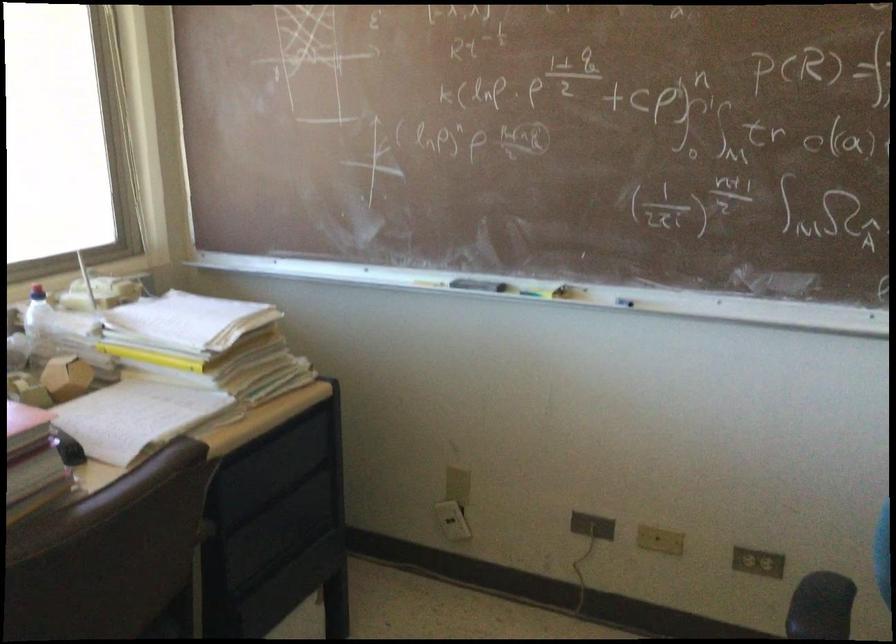
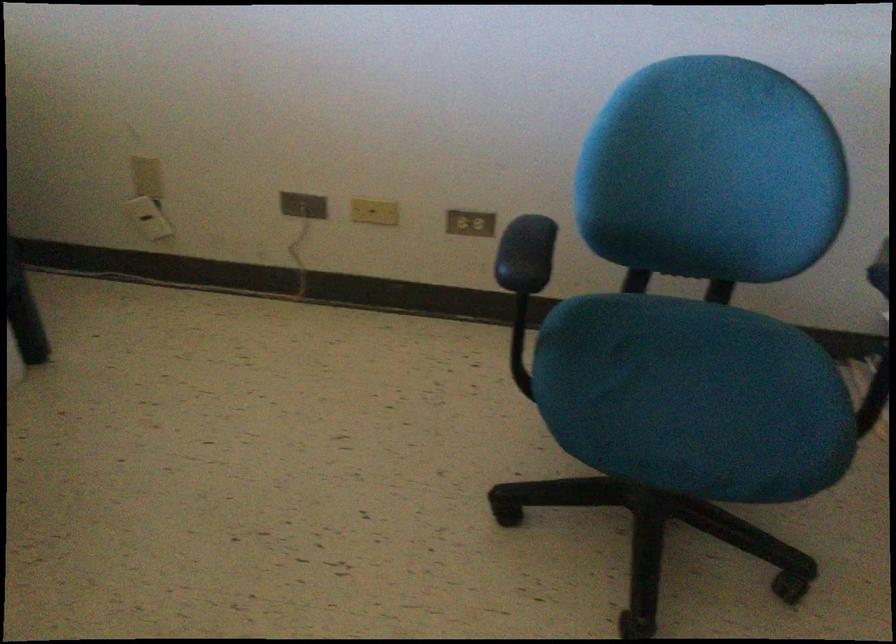
Based on the continuous images, in which direction is the camera rotating?

The camera's rotation is toward right-down.